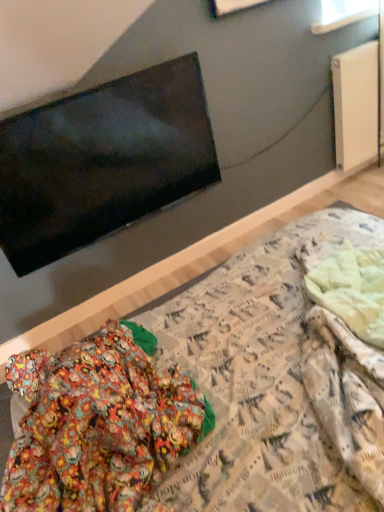
Where is `transparent glass window at upper right`? The height and width of the screenshot is (512, 384). transparent glass window at upper right is located at coordinates (343, 14).

In order to face flat matte black tv at upper left, should I rotate leftwards or rightwards?

You should look left and rotate roughly 10.710 degrees.

Measure the distance between flat matte black tv at upper left and camera.

The depth of flat matte black tv at upper left is 4.79 feet.

The height and width of the screenshot is (512, 384). I want to click on patterned fabric bed at center, so click(272, 380).

Identify the location of white matte radiator at upper right. The image size is (384, 512). (x=355, y=105).

Where is `transparent glass window at upper right`? transparent glass window at upper right is located at coordinates (343, 14).

From the image's perspective, between flat matte black tv at upper left and transparent glass window at upper right, who is located below?

From the image's view, flat matte black tv at upper left is below.

In the image, is flat matte black tv at upper left on the left side or the right side of transparent glass window at upper right?

From the image, it's evident that flat matte black tv at upper left is to the left of transparent glass window at upper right.

Is point (194, 181) less distant than point (316, 27)?

That is True.

Is transparent glass window at upper right bigger than patterned fabric bed at center?

No.

Could you tell me if transparent glass window at upper right is facing patterned fabric bed at center?

No, transparent glass window at upper right is not aimed at patterned fabric bed at center.

From the picture: From a real-world perspective, relative to patterned fabric bed at center, is transparent glass window at upper right vertically above or below?

transparent glass window at upper right is situated higher than patterned fabric bed at center in the real world.

In terms of height, does white matte radiator at upper right look taller or shorter compared to patterned fabric bed at center?

In the image, white matte radiator at upper right appears to be shorter than patterned fabric bed at center.

Can we say white matte radiator at upper right lies outside patterned fabric bed at center?

That's correct, white matte radiator at upper right is outside of patterned fabric bed at center.

Where is `radiator on the right of patterned fabric bed at center`? The height and width of the screenshot is (512, 384). radiator on the right of patterned fabric bed at center is located at coordinates (355, 105).

Does white matte radiator at upper right have a lesser width compared to patterned fabric bed at center?

Correct, the width of white matte radiator at upper right is less than that of patterned fabric bed at center.

Which of these two, white matte radiator at upper right or transparent glass window at upper right, stands shorter?

transparent glass window at upper right is shorter.

Based on the photo, how distant is white matte radiator at upper right from transparent glass window at upper right?

A distance of 13.57 inches exists between white matte radiator at upper right and transparent glass window at upper right.

From the picture: Is white matte radiator at upper right far away from transparent glass window at upper right?

No, white matte radiator at upper right is not far from transparent glass window at upper right.

Is white matte radiator at upper right positioned before transparent glass window at upper right?

No, white matte radiator at upper right is further to the viewer.

Which is behind, point (330, 6) or point (176, 199)?

The point (330, 6) is more distant.

Is transparent glass window at upper right shorter than flat matte black tv at upper left?

Indeed, transparent glass window at upper right has a lesser height compared to flat matte black tv at upper left.

Is there a large distance between transparent glass window at upper right and flat matte black tv at upper left?

transparent glass window at upper right is far away from flat matte black tv at upper left.

In the scene shown: Is white matte radiator at upper right closer to the viewer compared to flat matte black tv at upper left?

No, it is behind flat matte black tv at upper left.

How far apart are white matte radiator at upper right and flat matte black tv at upper left?

The distance of white matte radiator at upper right from flat matte black tv at upper left is 1.10 meters.

From a real-world perspective, does white matte radiator at upper right sit lower than flat matte black tv at upper left?

Yes.

Can flat matte black tv at upper left be found inside white matte radiator at upper right?

No, flat matte black tv at upper left is not inside white matte radiator at upper right.

Is patterned fabric bed at center oriented away from white matte radiator at upper right?

No.

Measure the distance from patterned fabric bed at center to white matte radiator at upper right.

patterned fabric bed at center is 4.18 feet away from white matte radiator at upper right.

Are patterned fabric bed at center and white matte radiator at upper right far apart?

Yes.

At what (x,y) coordinates should I click in order to perform the action: click on television located underneath the transparent glass window at upper right (from a real-world perspective). Please return your answer as a coordinate pair (x, y). The width and height of the screenshot is (384, 512). Looking at the image, I should click on 102,161.

In the image, there is a patterned fabric bed at center. Find the location of `window above it (from the image's perspective)`. window above it (from the image's perspective) is located at coordinates (343, 14).

Considering their positions, is white matte radiator at upper right positioned further to patterned fabric bed at center than transparent glass window at upper right?

transparent glass window at upper right is further to patterned fabric bed at center.

Considering their positions, is transparent glass window at upper right positioned closer to white matte radiator at upper right than patterned fabric bed at center?

transparent glass window at upper right is positioned closer to the anchor white matte radiator at upper right.

Based on their spatial positions, is patterned fabric bed at center or white matte radiator at upper right closer to flat matte black tv at upper left?

The object closer to flat matte black tv at upper left is patterned fabric bed at center.

When comparing their distances from patterned fabric bed at center, does flat matte black tv at upper left or transparent glass window at upper right seem closer?

flat matte black tv at upper left lies closer to patterned fabric bed at center than the other object.

When comparing their distances from flat matte black tv at upper left, does white matte radiator at upper right or transparent glass window at upper right seem closer?

Among the two, white matte radiator at upper right is located nearer to flat matte black tv at upper left.

From the image, which object appears to be farther from transparent glass window at upper right, patterned fabric bed at center or white matte radiator at upper right?

The object further to transparent glass window at upper right is patterned fabric bed at center.

When comparing their distances from transparent glass window at upper right, does flat matte black tv at upper left or patterned fabric bed at center seem further?

patterned fabric bed at center.

When comparing their distances from patterned fabric bed at center, does white matte radiator at upper right or flat matte black tv at upper left seem closer?

flat matte black tv at upper left lies closer to patterned fabric bed at center than the other object.

Where is `television located between patterned fabric bed at center and transparent glass window at upper right in the depth direction`? television located between patterned fabric bed at center and transparent glass window at upper right in the depth direction is located at coordinates (102, 161).

The height and width of the screenshot is (512, 384). In order to click on window located between patterned fabric bed at center and white matte radiator at upper right in the depth direction in this screenshot , I will do `click(343, 14)`.

The width and height of the screenshot is (384, 512). What are the coordinates of `television between patterned fabric bed at center and white matte radiator at upper right from front to back` in the screenshot? It's located at (102, 161).

Image resolution: width=384 pixels, height=512 pixels. In order to click on window located between flat matte black tv at upper left and white matte radiator at upper right in the left-right direction in this screenshot , I will do `click(343, 14)`.